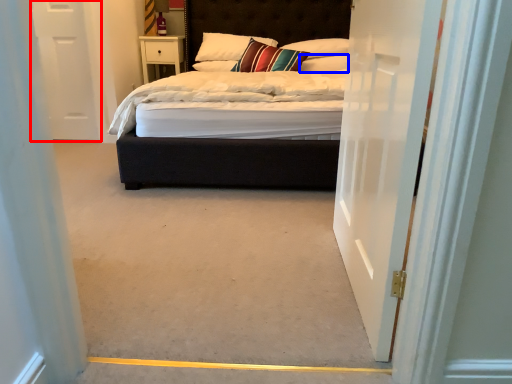
Question: Which object is further to the camera taking this photo, door (highlighted by a red box) or pillow (highlighted by a blue box)?

Choices:
 (A) door
 (B) pillow

Answer: (B)